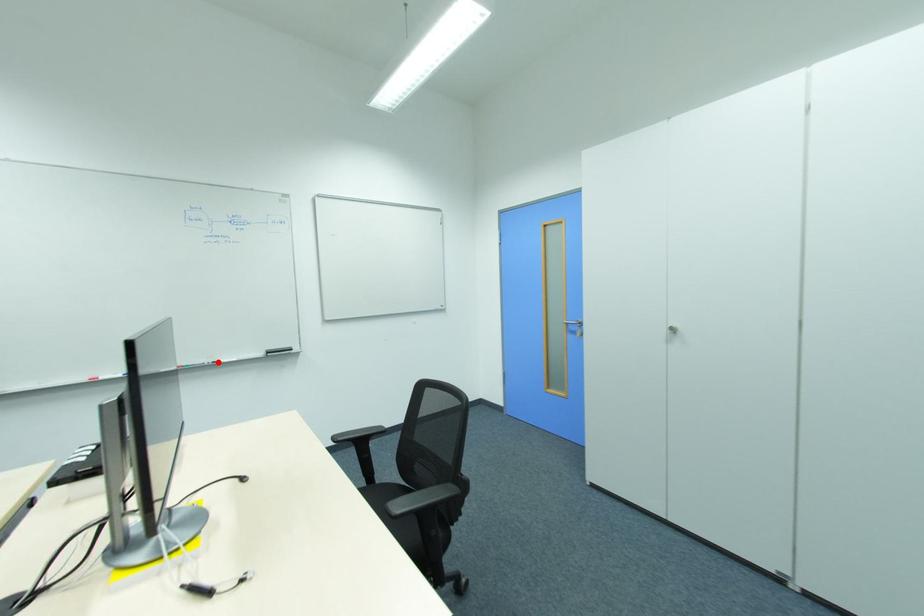
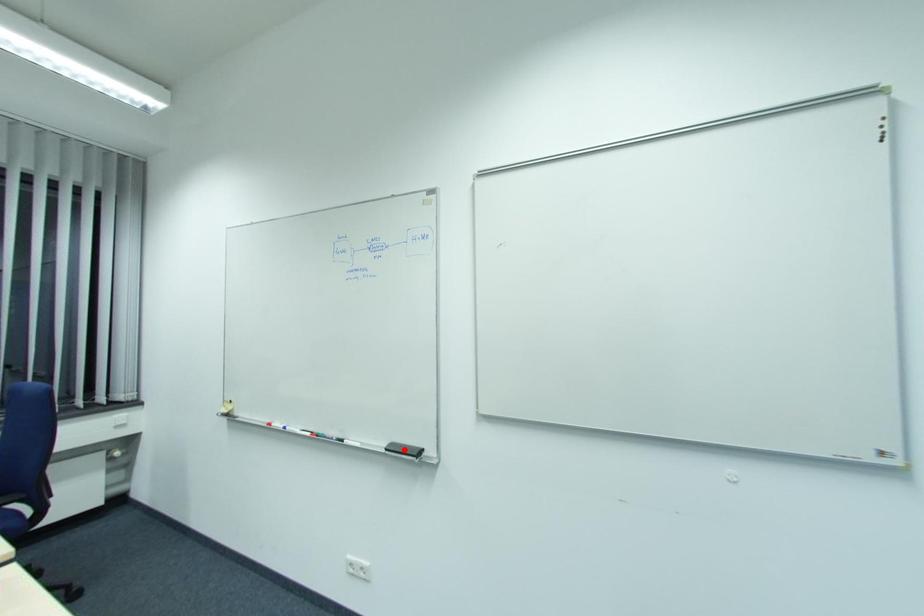
I am providing you with two images of the same scene from different viewpoints. A red point is marked on the first image and another point is marked on the second image. Do the highlighted points in image1 and image2 indicate the same real-world spot?

No